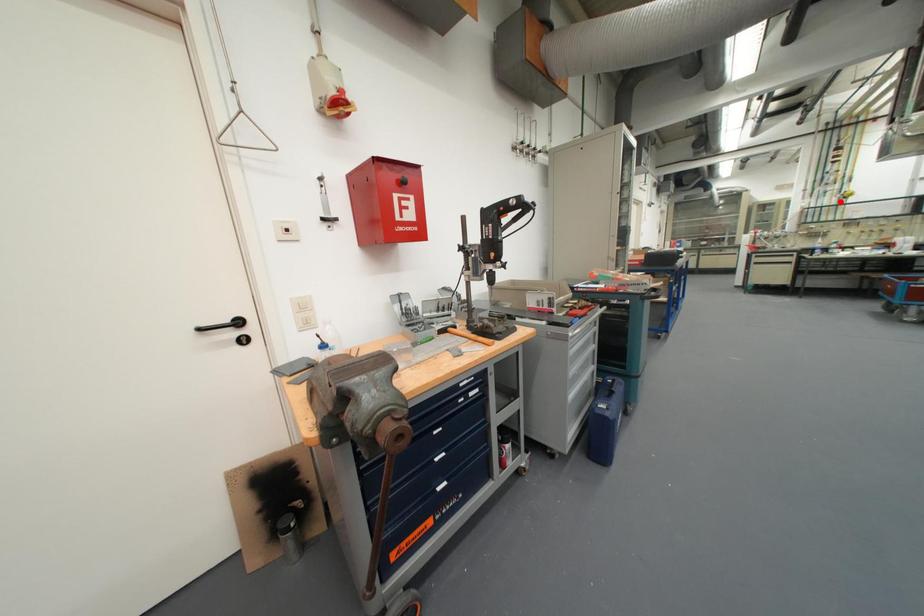
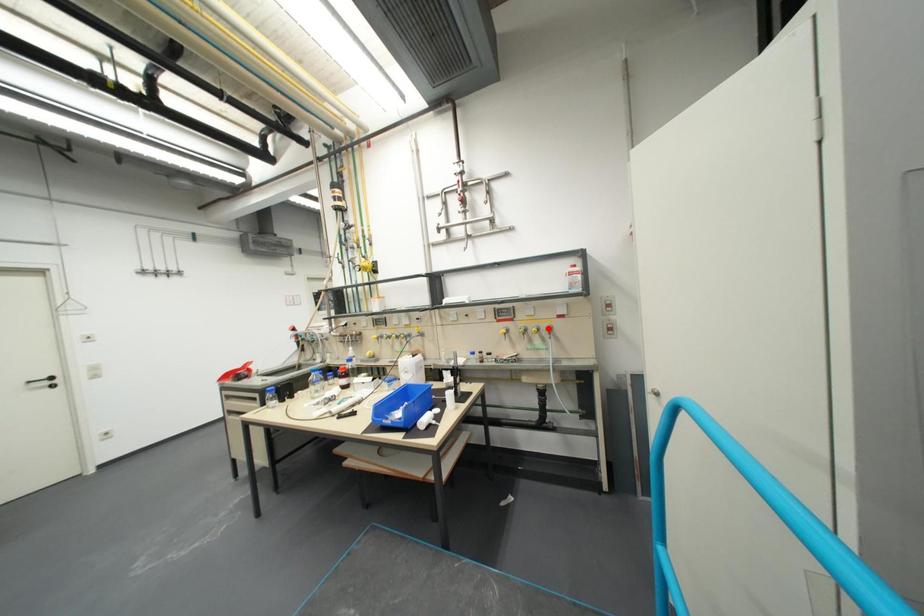
I am providing you with two images of the same scene from different viewpoints. A red point is marked on the first image and another point is marked on the second image. Is the marked point in image1 the same physical position as the marked point in image2?

No